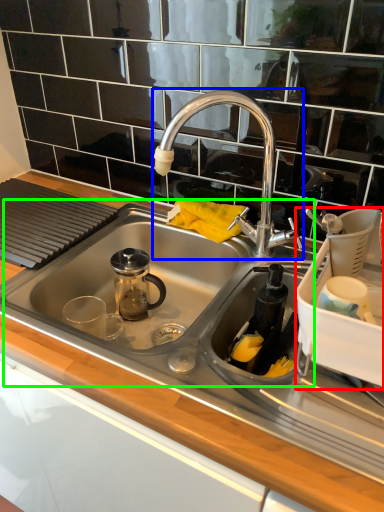
Question: Which is nearer to the appliance (highlighted by a red box)? tap (highlighted by a blue box) or sink (highlighted by a green box).

Choices:
 (A) tap
 (B) sink

Answer: (A)